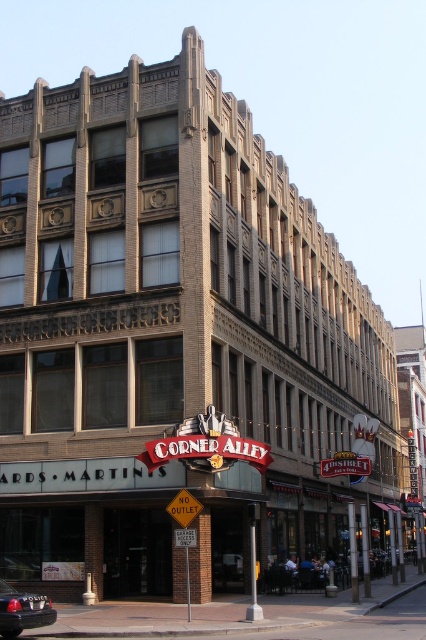
Can you confirm if metallic silver sedan at lower left is bigger than yellow plastic sign at lower center?

No.

This screenshot has height=640, width=426. Describe the element at coordinates (23, 611) in the screenshot. I see `metallic silver sedan at lower left` at that location.

Does point (19, 621) come in front of point (193, 500)?

Yes, point (19, 621) is in front of point (193, 500).

At what (x,y) coordinates should I click in order to perform the action: click on metallic silver sedan at lower left. Please return your answer as a coordinate pair (x, y). This screenshot has height=640, width=426. Looking at the image, I should click on (23, 611).